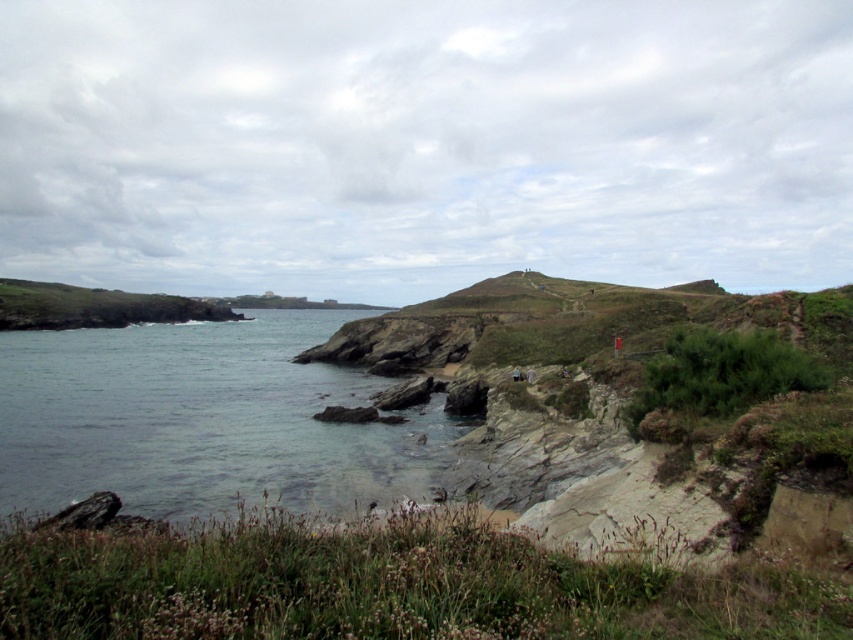
You are standing at the center of the image and want to walk towards the clear water at lower left and the green grassy hillside at left. Which object would you encounter first?

The clear water at lower left is positioned on the right side of green grassy hillside at left, so you would encounter the green grassy hillside at left first before reaching the clear water at lower left.

You are a hiker who wants to cross from the clear water at lower left to the green grassy hillside at left. Based on the scene, which area would you choose to step on first?

The green grassy hillside at left occupies more space than the clear water at lower left, so stepping onto the green grassy hillside at left first would be better as it provides a larger and safer area to stand.